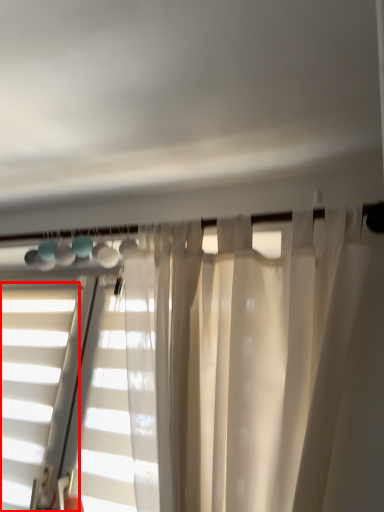
Question: From the image's perspective, where is window (annotated by the red box) located relative to bay window?

Choices:
 (A) below
 (B) above

Answer: (A)